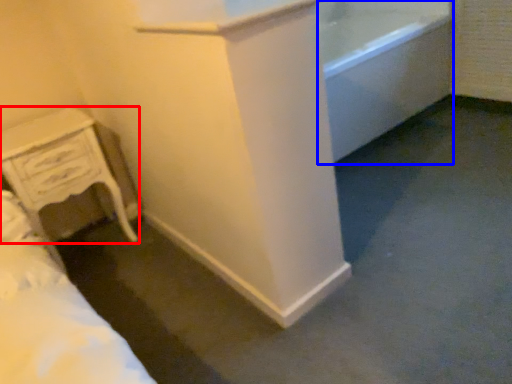
Question: Among these objects, which one is nearest to the camera, chest of drawers (highlighted by a red box) or bath (highlighted by a blue box)?

Choices:
 (A) chest of drawers
 (B) bath

Answer: (A)